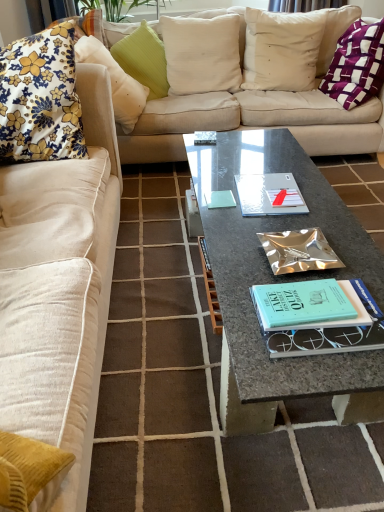
You are a GUI agent. You are given a task and a screenshot of the screen. Output one action in this format:
    pyautogui.click(x=<x>, y=<y>)
    Task: Click on the vacant area that lies between metallic silver book at center and silver metallic notebook at center
    
    Given the screenshot: What is the action you would take?
    pyautogui.click(x=276, y=225)